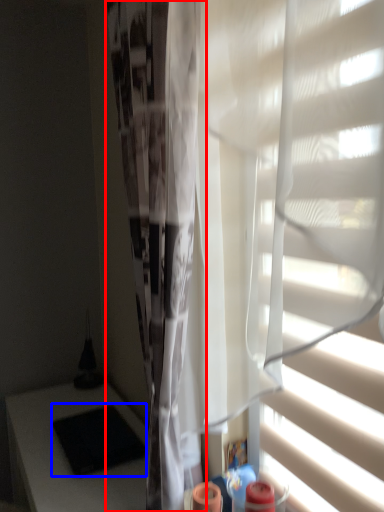
Question: Which point is closer to the camera, shower curtain (highlighted by a red box) or pad (highlighted by a blue box)?

Choices:
 (A) shower curtain
 (B) pad

Answer: (A)